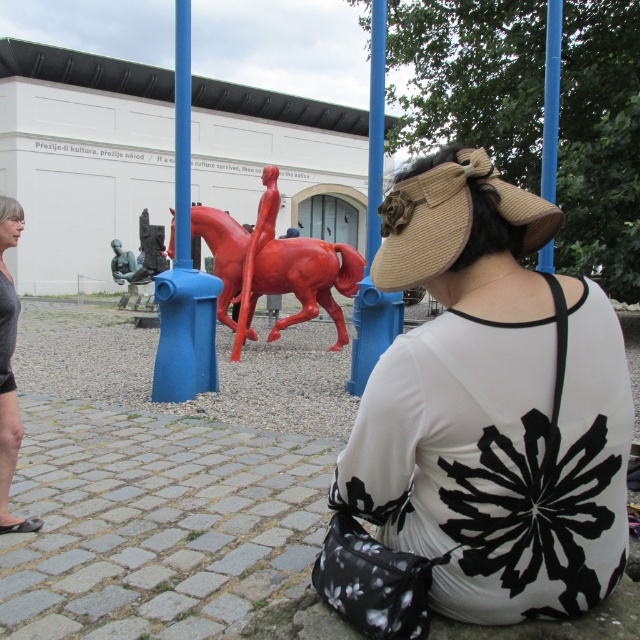
You are an artist standing at the center of the image. You want to place a new sculpture exactly 0.1 units to the right of the gray fabric pants at lower left. What are the coordinates where you should place the new sculpture?

The gray fabric pants at lower left are located at point (8, 369). Adding 0.1 to the x coordinate gives 0.678. The new coordinates are (8, 433).